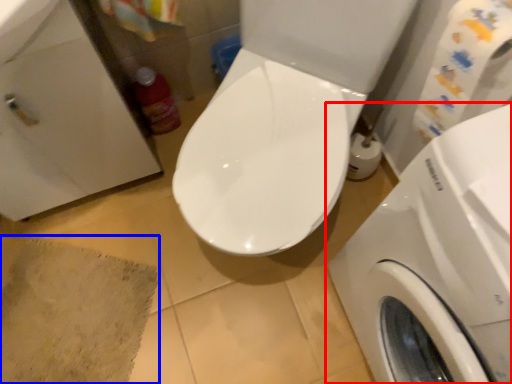
Question: Among these objects, which one is nearest to the camera, washing machine (highlighted by a red box) or bath mat (highlighted by a blue box)?

Choices:
 (A) washing machine
 (B) bath mat

Answer: (A)